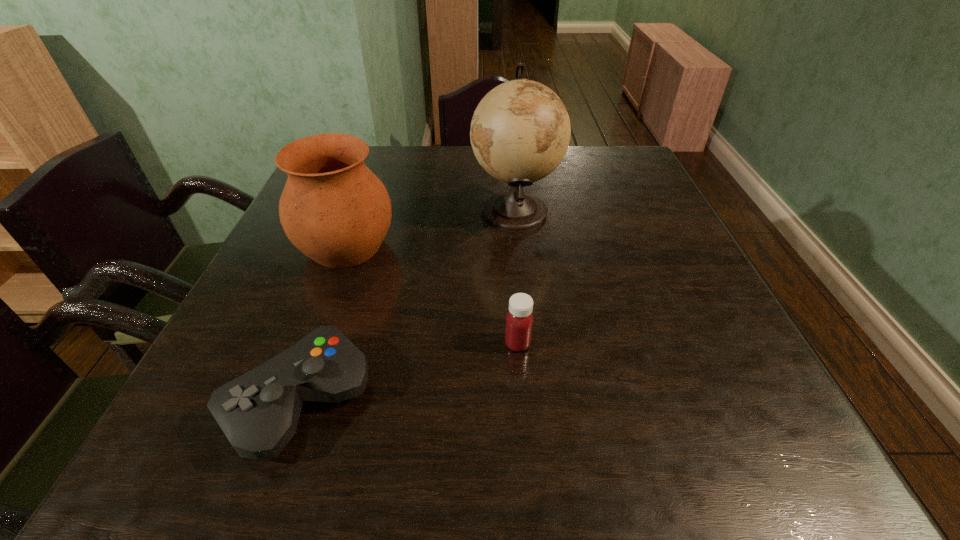
In order to click on object identified as the second closest to the second shortest object in this screenshot , I will do `click(520, 131)`.

Point out which object is positioned as the second nearest to the medicine. Please provide its 2D coordinates. Your answer should be formatted as a tuple, i.e. [(x, y)], where the tuple contains the x and y coordinates of a point satisfying the conditions above.

[(520, 131)]

Identify the location of vacant space that satisfies the following two spatial constraints: 1. on the front side of the third shortest object; 2. on the right side of the control. (290, 400).

What are the coordinates of `vacant space that satisfies the following two spatial constraints: 1. on the back side of the shortest object; 2. on the right side of the medicine` in the screenshot? It's located at (320, 343).

You are a GUI agent. You are given a task and a screenshot of the screen. Output one action in this format:
    pyautogui.click(x=<x>, y=<y>)
    Task: Click on the free space that satisfies the following two spatial constraints: 1. on the front-facing side of the tallest object; 2. on the front side of the third shortest object
    The height and width of the screenshot is (540, 960).
    Given the screenshot: What is the action you would take?
    pyautogui.click(x=518, y=246)